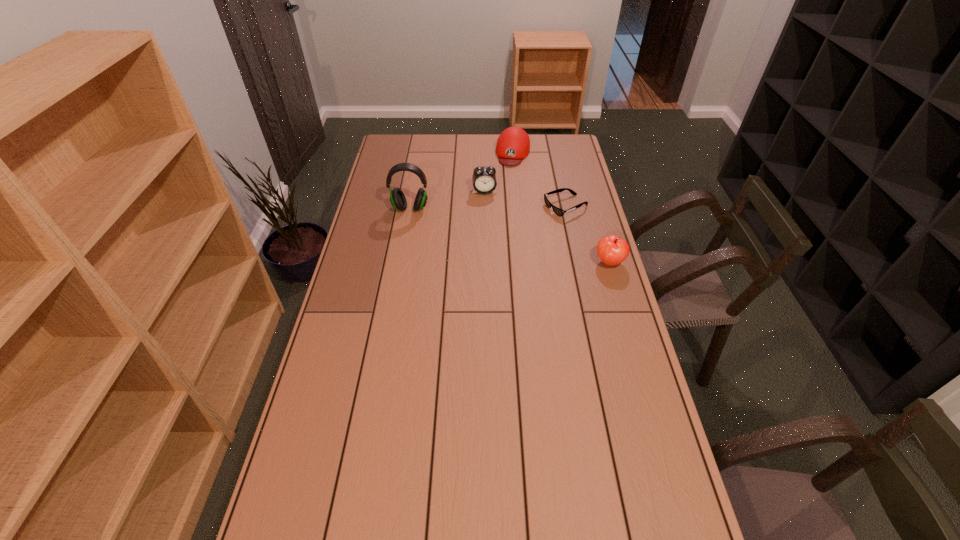
In order to click on vacant region located on the front-facing side of the sunglasses in this screenshot , I will do `click(527, 221)`.

Find the location of a particular element. The image size is (960, 540). free region located on the front-facing side of the sunglasses is located at coordinates (511, 228).

Where is `free space located 0.160m on the front-facing side of the baseball cap`? This screenshot has height=540, width=960. free space located 0.160m on the front-facing side of the baseball cap is located at coordinates (507, 187).

Locate an element on the screen. The width and height of the screenshot is (960, 540). free point located 0.320m on the front-facing side of the baseball cap is located at coordinates (501, 210).

Where is `free space located on the front-facing side of the baseball cap`? The height and width of the screenshot is (540, 960). free space located on the front-facing side of the baseball cap is located at coordinates (505, 192).

Find the location of a particular element. The width and height of the screenshot is (960, 540). free spot located 0.210m on the front side of the second object from left to right is located at coordinates (492, 228).

Locate an element on the screen. The image size is (960, 540). vacant space located 0.100m on the front side of the second object from left to right is located at coordinates (489, 211).

Identify the location of vacant region located 0.330m on the front side of the second object from left to right. The width and height of the screenshot is (960, 540). (494, 248).

This screenshot has height=540, width=960. I want to click on object at the far edge, so click(513, 145).

You are a GUI agent. You are given a task and a screenshot of the screen. Output one action in this format:
    pyautogui.click(x=<x>, y=<y>)
    Task: Click on the object that is at the left edge
    
    Given the screenshot: What is the action you would take?
    pyautogui.click(x=397, y=198)